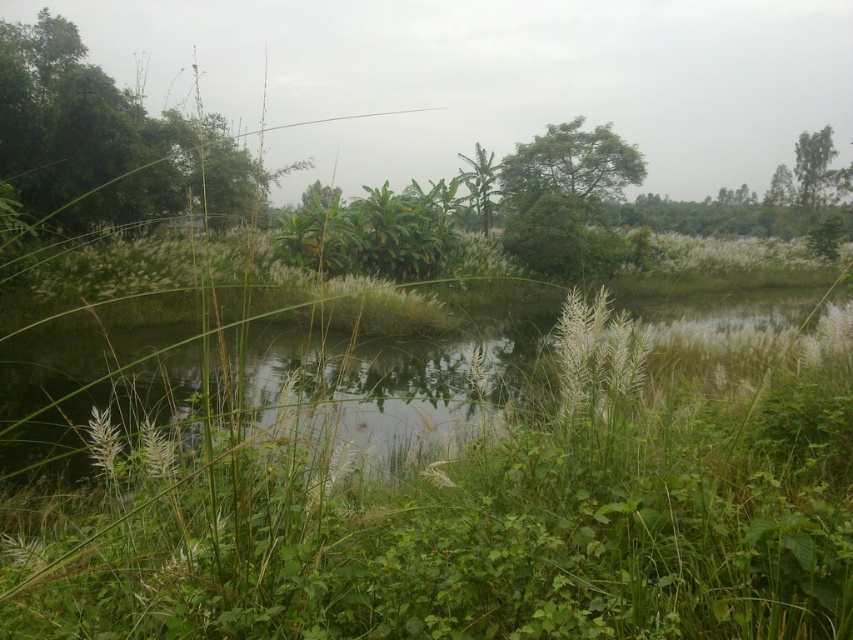
Can you confirm if green leafy tree at left is smaller than green leafy tree at upper right?

Correct, green leafy tree at left occupies less space than green leafy tree at upper right.

Is the position of green leafy tree at left more distant than that of green leafy tree at upper right?

No, green leafy tree at left is in front of green leafy tree at upper right.

Is point (38, 104) closer to viewer compared to point (804, 189)?

That is True.

At what (x,y) coordinates should I click in order to perform the action: click on green leafy tree at left. Please return your answer as a coordinate pair (x, y). Looking at the image, I should click on (84, 134).

Who is positioned more to the right, green leafy tree at left or green leafy plant at center?

green leafy plant at center

Is green leafy tree at left bigger than green leafy plant at center?

Yes, green leafy tree at left is bigger than green leafy plant at center.

Which is in front, point (12, 44) or point (490, 166)?

Point (12, 44) is in front.

Locate an element on the screen. Image resolution: width=853 pixels, height=640 pixels. green leafy tree at left is located at coordinates (84, 134).

Is green leafy tree at upper right shorter than green leafy plant at center?

No, green leafy tree at upper right is not shorter than green leafy plant at center.

Can you confirm if green leafy tree at upper right is taller than green leafy plant at center?

Correct, green leafy tree at upper right is much taller as green leafy plant at center.

At what (x,y) coordinates should I click in order to perform the action: click on green leafy tree at upper right. Please return your answer as a coordinate pair (x, y). Looking at the image, I should click on (811, 163).